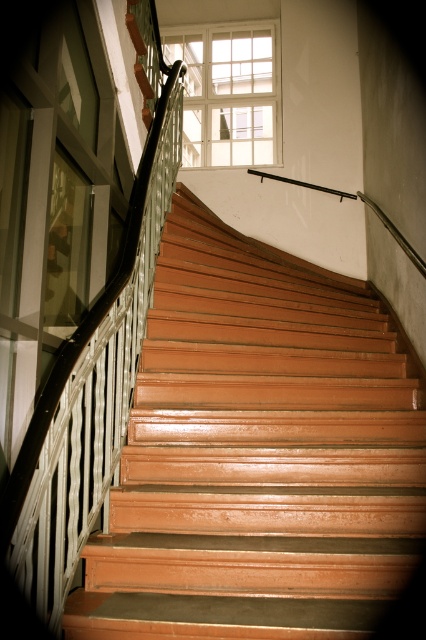
Question: Does peach glossy stairs at center have a larger size compared to clear glass window at upper center?

Choices:
 (A) no
 (B) yes

Answer: (B)

Question: Is peach glossy stairs at center to the right of clear glass window at upper center from the viewer's perspective?

Choices:
 (A) no
 (B) yes

Answer: (B)

Question: Which point is farther from the camera taking this photo?

Choices:
 (A) (206, 52)
 (B) (89, 579)

Answer: (A)

Question: Which object is closer to the camera taking this photo?

Choices:
 (A) clear glass window at upper center
 (B) peach glossy stairs at center

Answer: (B)

Question: Among these objects, which one is nearest to the camera?

Choices:
 (A) clear glass window at upper center
 (B) peach glossy stairs at center

Answer: (B)

Question: Does peach glossy stairs at center have a lesser width compared to clear glass window at upper center?

Choices:
 (A) no
 (B) yes

Answer: (A)